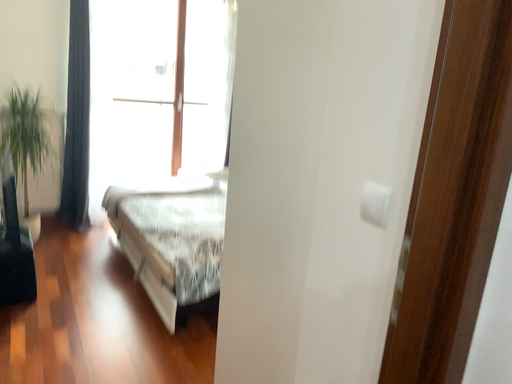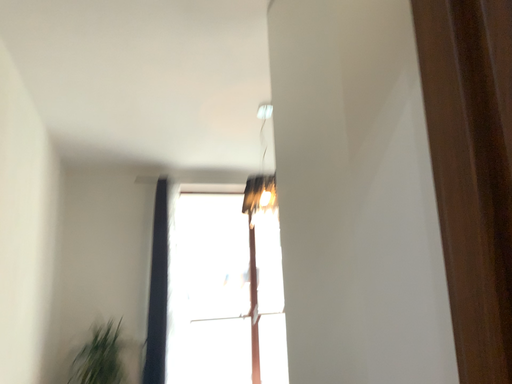
Question: Which way did the camera rotate in the video?

Choices:
 (A) rotated downward
 (B) rotated upward

Answer: (B)